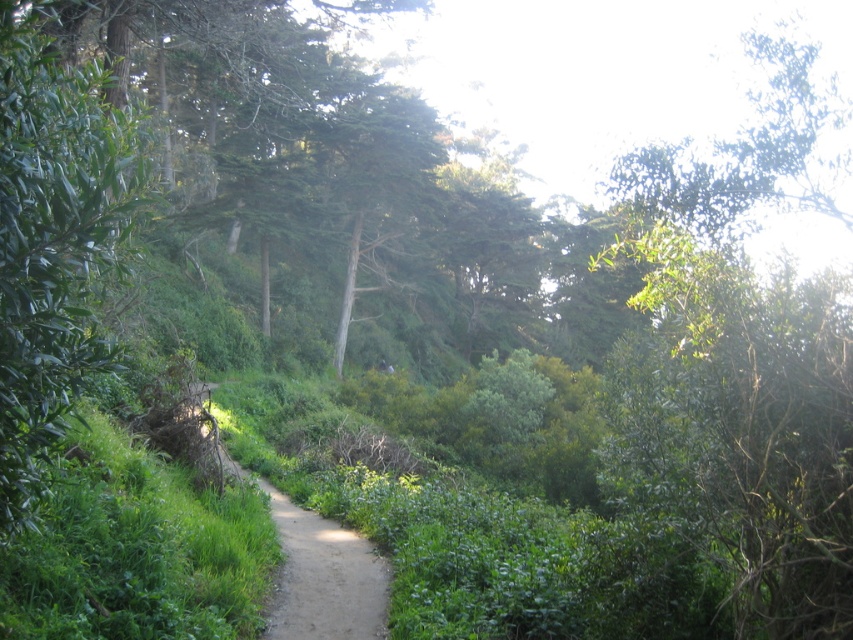
You are standing at the center of the path in the forest scene. Looking towards the green leafy tree at left, in which direction relative to your position is the tree located?

The green leafy tree at left is located to the left side of your position based on its 2D coordinates at point (x=53, y=241).